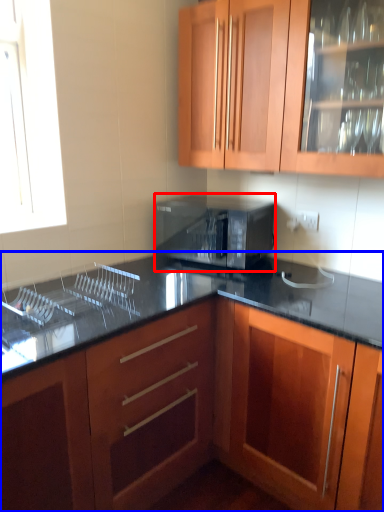
Question: Which of the following is the closest to the observer, microwave oven (highlighted by a red box) or cabinetry (highlighted by a blue box)?

Choices:
 (A) microwave oven
 (B) cabinetry

Answer: (B)